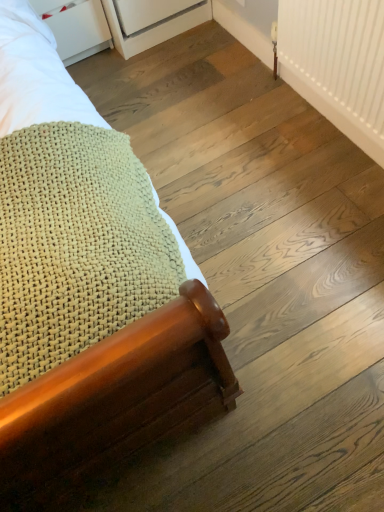
Where is `blank space to the left of white plastic radiator at upper right`? The width and height of the screenshot is (384, 512). blank space to the left of white plastic radiator at upper right is located at coordinates (x=230, y=143).